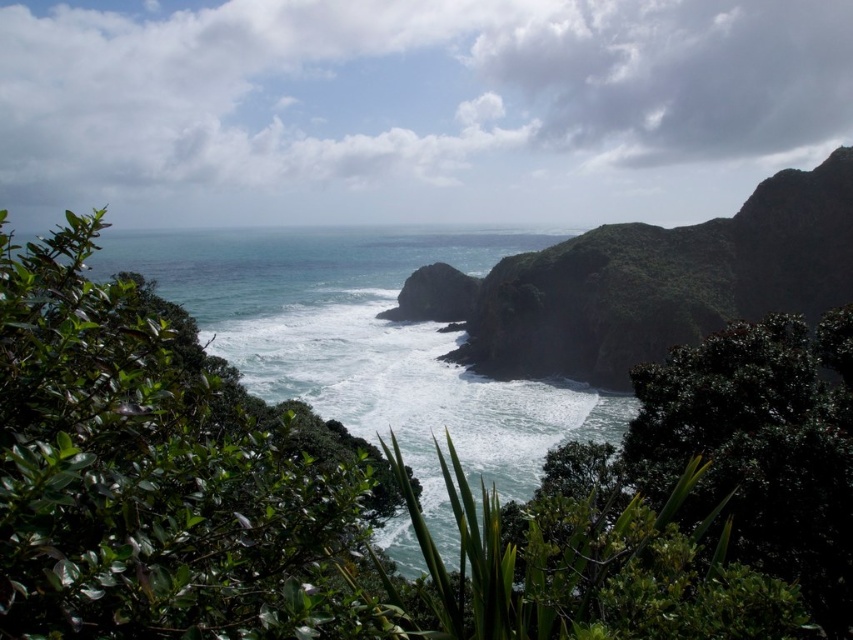
In the scene shown: You are standing at the edge of the cliff in the coastal landscape. You see the greenish blue water at center marked by point [369,342]. Is the water at that point closer to the cliff or farther away from it?

The greenish blue water at center marked by point [369,342] is farther away from the cliff because it is located at the center of the image, which is typically the middle ground or background in such landscapes.